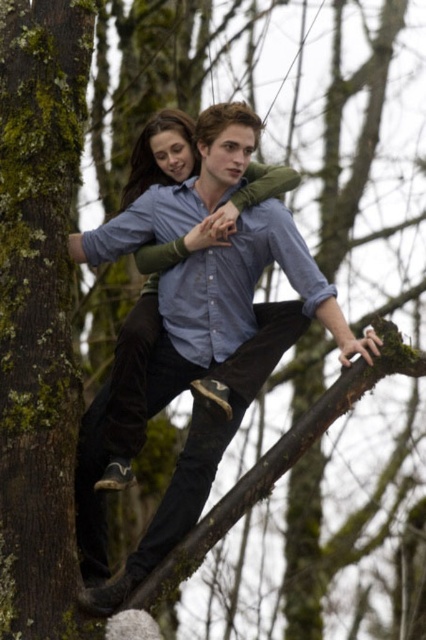
Question: Is brown rough bark at left positioned in front of matte blue shirt at center?

Choices:
 (A) yes
 (B) no

Answer: (A)

Question: Is brown rough bark at left wider than matte blue shirt at center?

Choices:
 (A) no
 (B) yes

Answer: (A)

Question: Does brown rough bark at left have a lesser width compared to matte blue shirt at center?

Choices:
 (A) yes
 (B) no

Answer: (A)